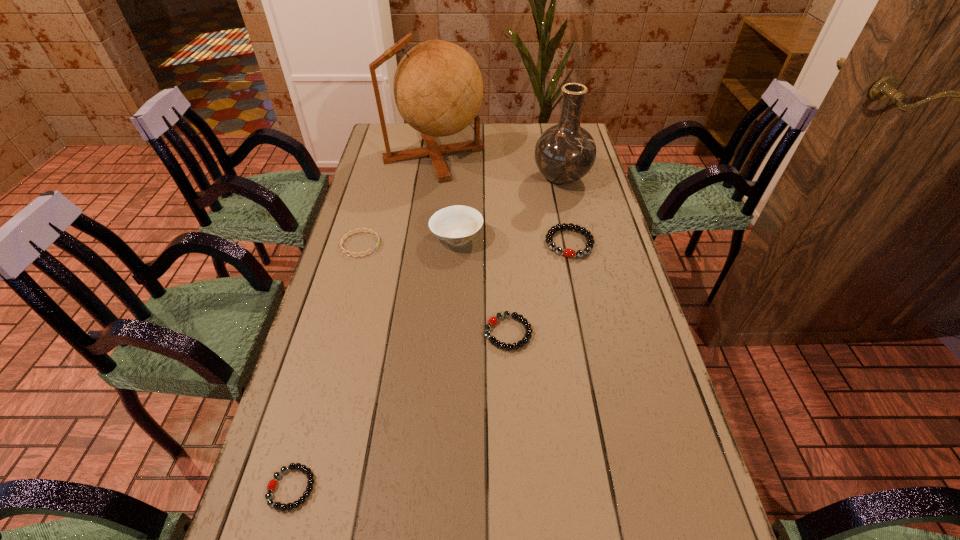
Find the location of a particular element. The height and width of the screenshot is (540, 960). unoccupied area between the sixth shortest object and the nearest black bracelet is located at coordinates (426, 333).

You are a GUI agent. You are given a task and a screenshot of the screen. Output one action in this format:
    pyautogui.click(x=<x>, y=<y>)
    Task: Click on the closest object to the blue bracelet
    This screenshot has width=960, height=540.
    Given the screenshot: What is the action you would take?
    (x=456, y=225)

Choose which object is the sixth nearest neighbor to the sixth shortest object. Please provide its 2D coordinates. Your answer should be formatted as a tuple, i.e. [(x, y)], where the tuple contains the x and y coordinates of a point satisfying the conditions above.

[(272, 484)]

Locate which bracelet ranks third in proximity to the smallest black bracelet. Please provide its 2D coordinates. Your answer should be formatted as a tuple, i.e. [(x, y)], where the tuple contains the x and y coordinates of a point satisfying the conditions above.

[(567, 252)]

At what (x,y) coordinates should I click in order to perform the action: click on bracelet that is the third nearest to the nearest black bracelet. Please return your answer as a coordinate pair (x, y). The image size is (960, 540). Looking at the image, I should click on (567, 252).

Choose which black bracelet is the third nearest neighbor to the blue bracelet. Please provide its 2D coordinates. Your answer should be formatted as a tuple, i.e. [(x, y)], where the tuple contains the x and y coordinates of a point satisfying the conditions above.

[(272, 484)]

Point out which black bracelet is positioned as the nearest to the nearest bracelet. Please provide its 2D coordinates. Your answer should be formatted as a tuple, i.e. [(x, y)], where the tuple contains the x and y coordinates of a point satisfying the conditions above.

[(492, 321)]

This screenshot has height=540, width=960. Identify the location of free spot that satisfies the following two spatial constraints: 1. on the back side of the vase; 2. on the right side of the tallest bracelet. (556, 179).

Where is `vacant space that satisfies the following two spatial constraints: 1. on the surface of the tallest object; 2. on the right side of the beige bowl`? vacant space that satisfies the following two spatial constraints: 1. on the surface of the tallest object; 2. on the right side of the beige bowl is located at coordinates (422, 237).